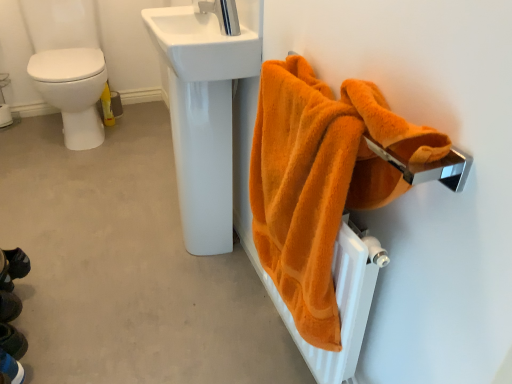
Question: Is the depth of orange fluffy towel at right less than that of dark blue fabric shoes at lower left?

Choices:
 (A) yes
 (B) no

Answer: (A)

Question: From a real-world perspective, is orange fluffy towel at right on top of dark blue fabric shoes at lower left?

Choices:
 (A) no
 (B) yes

Answer: (B)

Question: Does orange fluffy towel at right contain dark blue fabric shoes at lower left?

Choices:
 (A) no
 (B) yes

Answer: (A)

Question: Is orange fluffy towel at right wider than dark blue fabric shoes at lower left?

Choices:
 (A) no
 (B) yes

Answer: (A)

Question: From the image's perspective, is orange fluffy towel at right on top of dark blue fabric shoes at lower left?

Choices:
 (A) yes
 (B) no

Answer: (A)

Question: Is white leather shoe at lower left inside the boundaries of dark blue fabric shoes at lower left, or outside?

Choices:
 (A) inside
 (B) outside

Answer: (B)

Question: Is point (6, 364) closer or farther from the camera than point (19, 349)?

Choices:
 (A) farther
 (B) closer

Answer: (B)

Question: Based on their positions, is white leather shoe at lower left located to the left or right of dark blue fabric shoes at lower left?

Choices:
 (A) right
 (B) left

Answer: (A)

Question: From a real-world perspective, is white leather shoe at lower left above or below dark blue fabric shoes at lower left?

Choices:
 (A) below
 (B) above

Answer: (A)

Question: From a real-world perspective, relative to white leather shoe at lower left, is white glossy sink at upper center vertically above or below?

Choices:
 (A) below
 (B) above

Answer: (B)

Question: Is white glossy sink at upper center in front of or behind white leather shoe at lower left in the image?

Choices:
 (A) front
 (B) behind

Answer: (B)

Question: From the image's perspective, relative to white leather shoe at lower left, is white glossy sink at upper center above or below?

Choices:
 (A) above
 (B) below

Answer: (A)

Question: Considering the positions of white glossy sink at upper center and white leather shoe at lower left in the image, is white glossy sink at upper center taller or shorter than white leather shoe at lower left?

Choices:
 (A) tall
 (B) short

Answer: (B)

Question: From the image's perspective, is white glossy sink at upper center positioned above or below orange fluffy towel at right?

Choices:
 (A) below
 (B) above

Answer: (B)

Question: Does point [x=245, y=56] appear closer or farther from the camera than point [x=287, y=132]?

Choices:
 (A) closer
 (B) farther

Answer: (B)